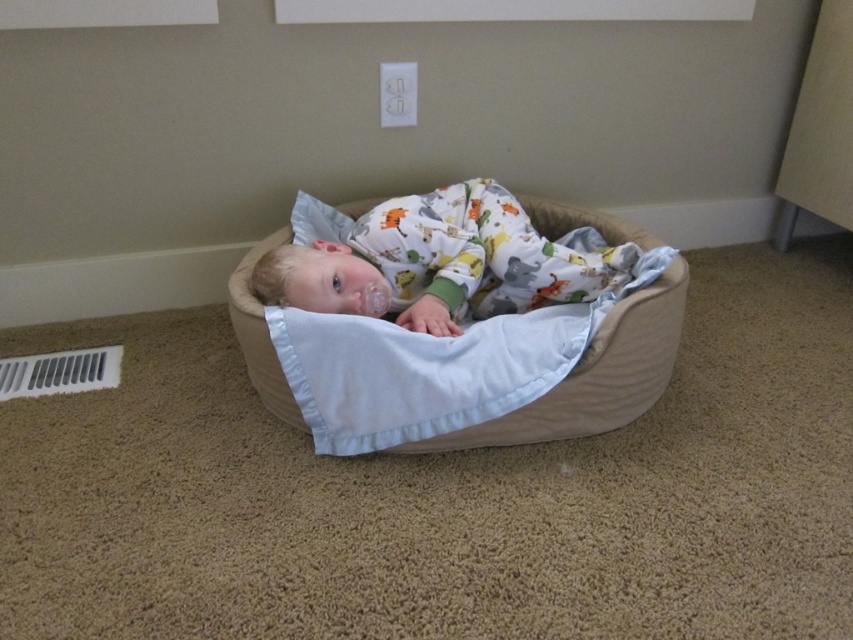
You are a parent trying to move your baby from the beige fabric infant bed at center to a new crib. The new crib has the same dimensions as the white soft baby at center. Will the baby fit comfortably in the new crib?

The beige fabric infant bed at center is wider than the white soft baby at center. Since the new crib has the same dimensions as the baby, it may be slightly snug, but the baby should still fit comfortably as long as the crib meets safety standards.

Consider the image. You are a caregiver checking on the baby. Based on the scene, is the white soft baby at center lying inside the beige fabric infant bed at center?

The beige fabric infant bed at center is below the white soft baby at center, so the baby is lying inside the bed.

You are a parent trying to place a new toy in the baby room. The toy needs to be placed between the beige fabric infant bed at center and the white soft pillow at upper center. Based on the scene, which object should the toy be closer to?

The beige fabric infant bed at center is to the right of the white soft pillow at upper center, so the toy should be placed closer to the white soft pillow at upper center to be between them.